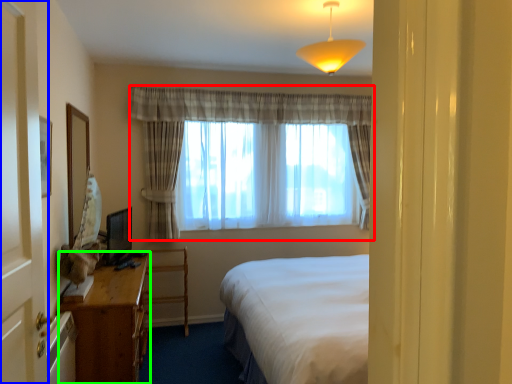
Question: Which is nearer to the curtain (highlighted by a red box)? screen door (highlighted by a blue box) or desk (highlighted by a green box).

Choices:
 (A) screen door
 (B) desk

Answer: (B)